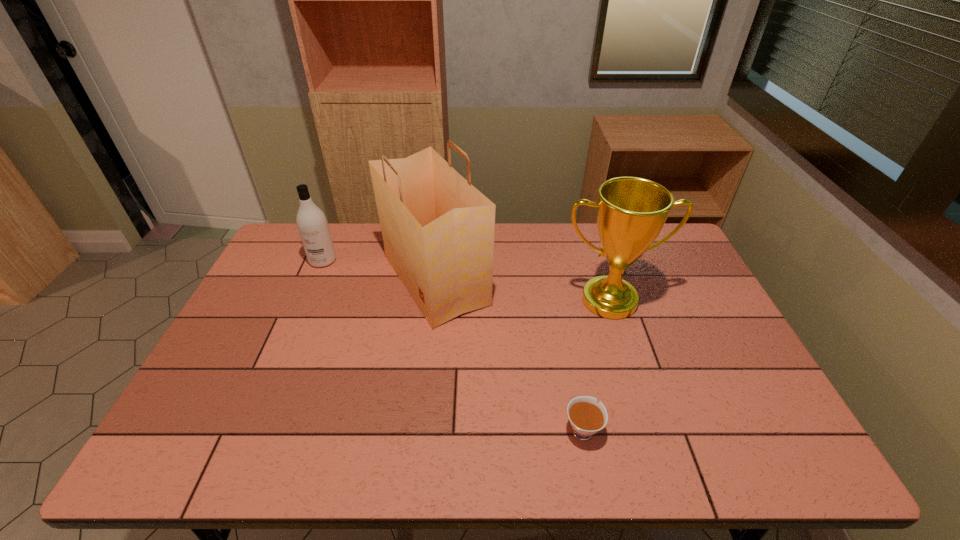
Where is `the closest object to the award`? the closest object to the award is located at coordinates (438, 230).

I want to click on blank area in the image that satisfies the following two spatial constraints: 1. on the side of the grocery bag with the superhero design; 2. on the side of the teacup with the handle, so click(419, 429).

The image size is (960, 540). What are the coordinates of `free space in the image that satisfies the following two spatial constraints: 1. on the side of the shortest object with the handle; 2. on the side of the grocery bag with the superhero design` in the screenshot? It's located at (554, 280).